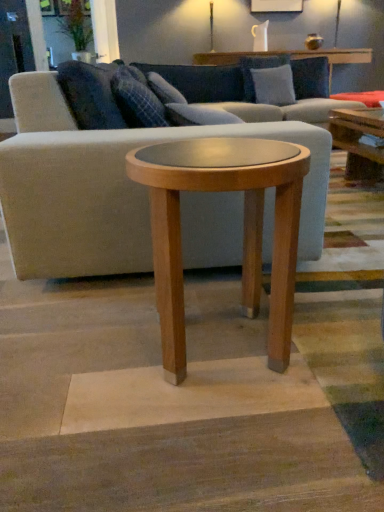
This screenshot has height=512, width=384. Find the location of `free space to the left of light brown wood side table at center`. free space to the left of light brown wood side table at center is located at coordinates (76, 347).